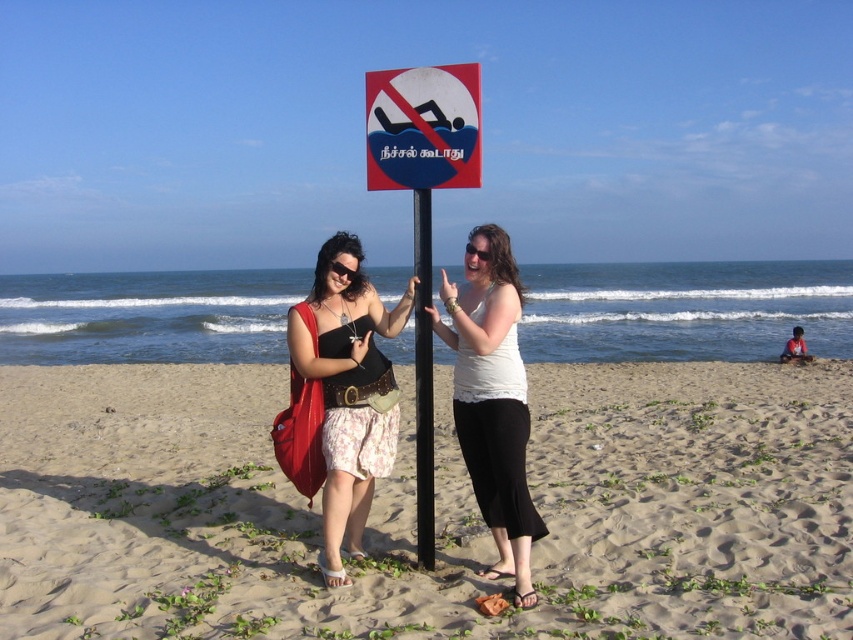
You are a photographer trying to capture a wide shot of both the sandy beach at lower center and the blue plastic sign at center. Given that your camera has a maximum focus range of 6 meters, will you be able to capture both objects in focus without moving the camera?

The sandy beach at lower center and blue plastic sign at center are 6.45 meters apart from each other. Since the distance between them exceeds the camera maximum focus range of 6 meters, you will not be able to capture both objects in focus without moving the camera.

You are a photographer trying to capture the two women in the scene. Since the matte black top at center and the blue plastic sign at center are both at the center, which one is closer to the camera?

The matte black top at center is in front of the blue plastic sign at center, so it is closer to the camera.